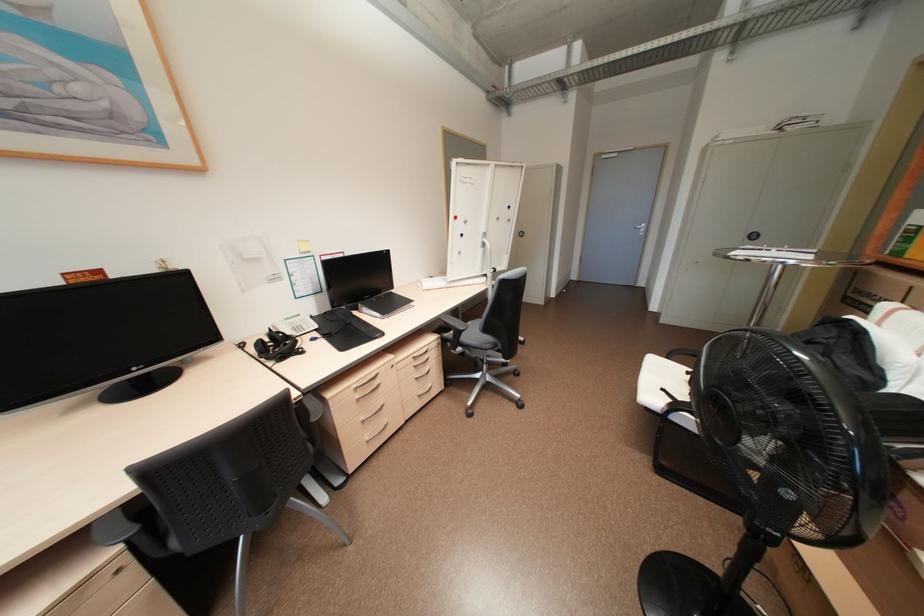
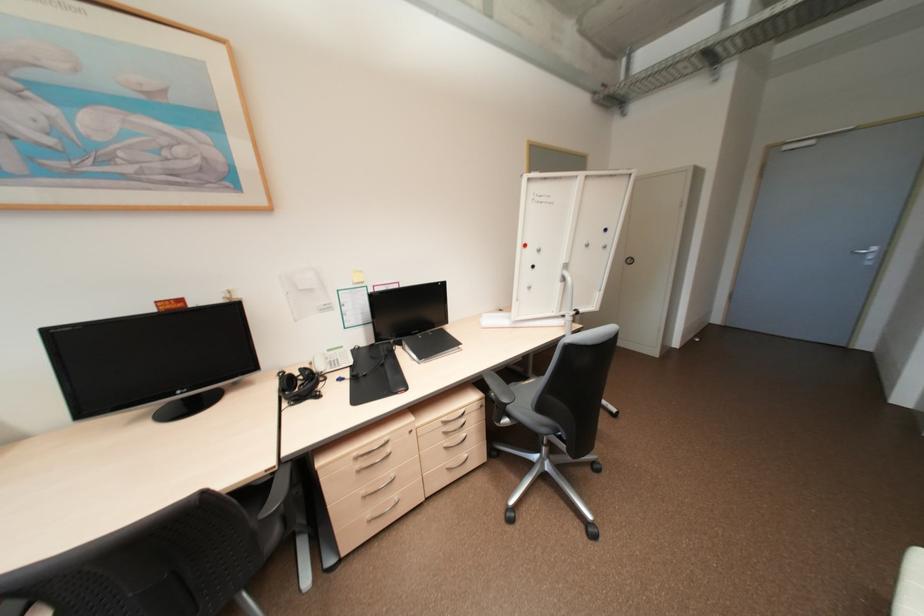
In the second image, find the point that corresponds to point (460, 217) in the first image.

(530, 245)